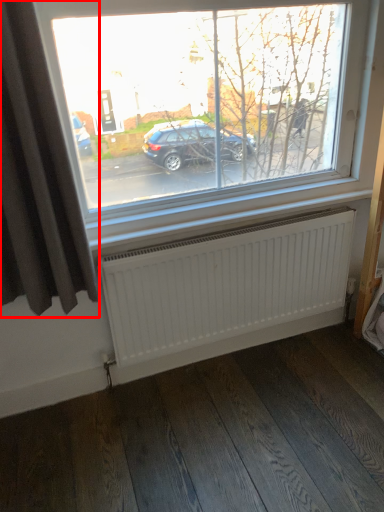
Question: From the image's perspective, what is the correct spatial positioning of curtain (annotated by the red box) in reference to radiator?

Choices:
 (A) above
 (B) below

Answer: (A)